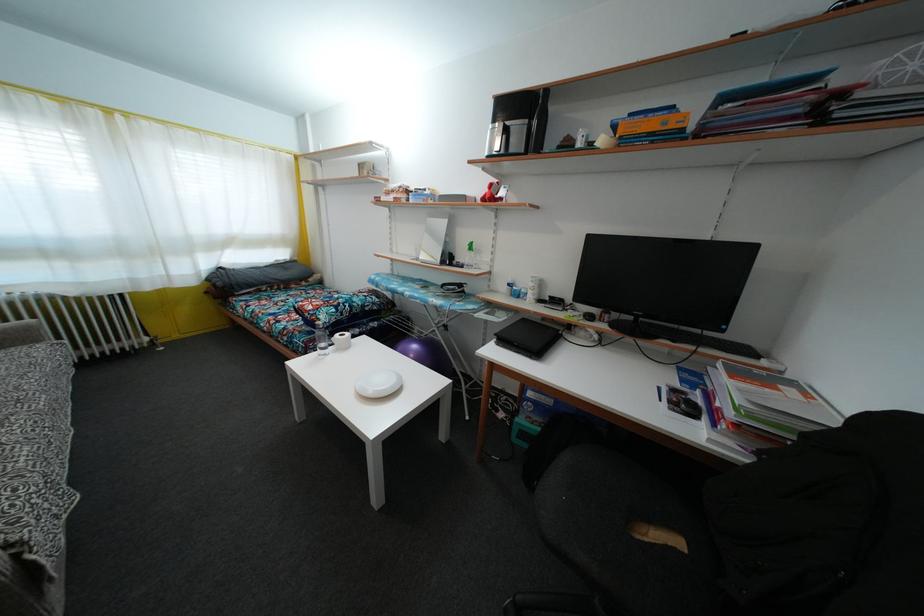
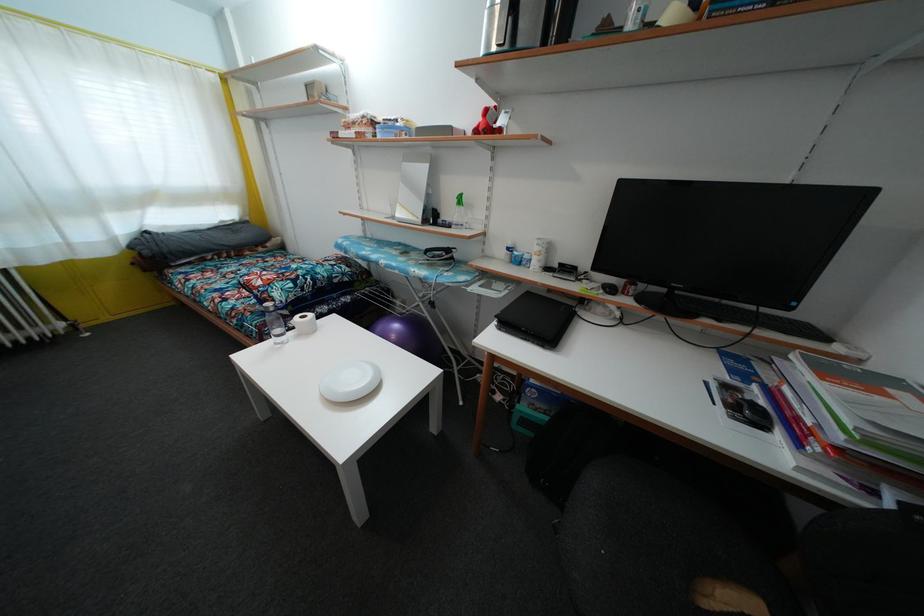
In the second image, find the point that corresponds to (507,347) in the first image.

(512, 331)